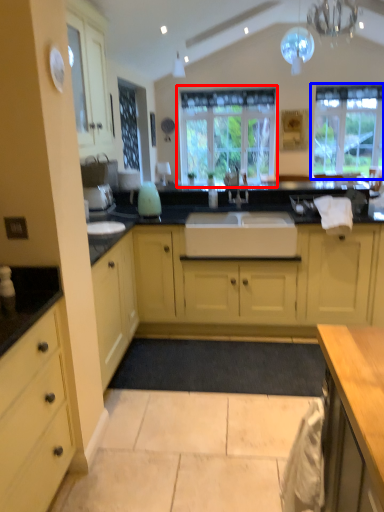
Question: Which object appears farthest to the camera in this image, window (highlighted by a red box) or window (highlighted by a blue box)?

Choices:
 (A) window
 (B) window

Answer: (A)